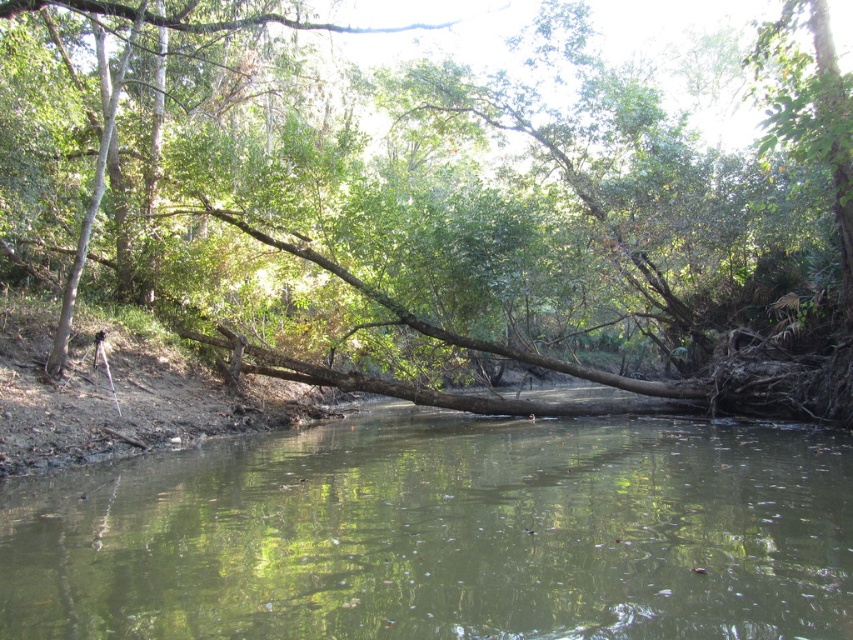
Question: Does brown rough log at center appear on the left side of green muddy river at center?

Choices:
 (A) yes
 (B) no

Answer: (A)

Question: Among these points, which one is farthest from the camera?

Choices:
 (A) (152, 202)
 (B) (131, 620)

Answer: (A)

Question: Considering the relative positions of brown rough log at center and green muddy river at center in the image provided, where is brown rough log at center located with respect to green muddy river at center?

Choices:
 (A) left
 (B) right

Answer: (A)

Question: Which point is farther to the camera?

Choices:
 (A) green muddy river at center
 (B) brown rough log at center

Answer: (B)

Question: Does brown rough log at center have a larger size compared to green muddy river at center?

Choices:
 (A) yes
 (B) no

Answer: (A)